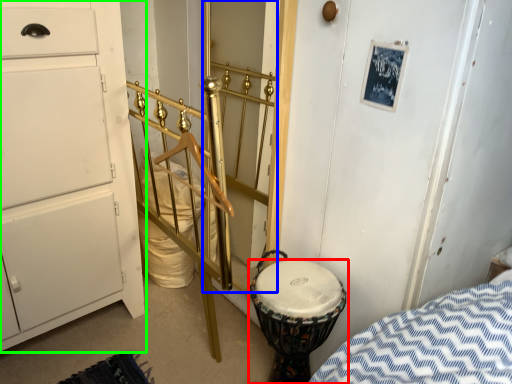
Question: Considering the real-world distances, which object is closest to drum (highlighted by a red box)? door (highlighted by a blue box) or chest of drawers (highlighted by a green box).

Choices:
 (A) door
 (B) chest of drawers

Answer: (A)